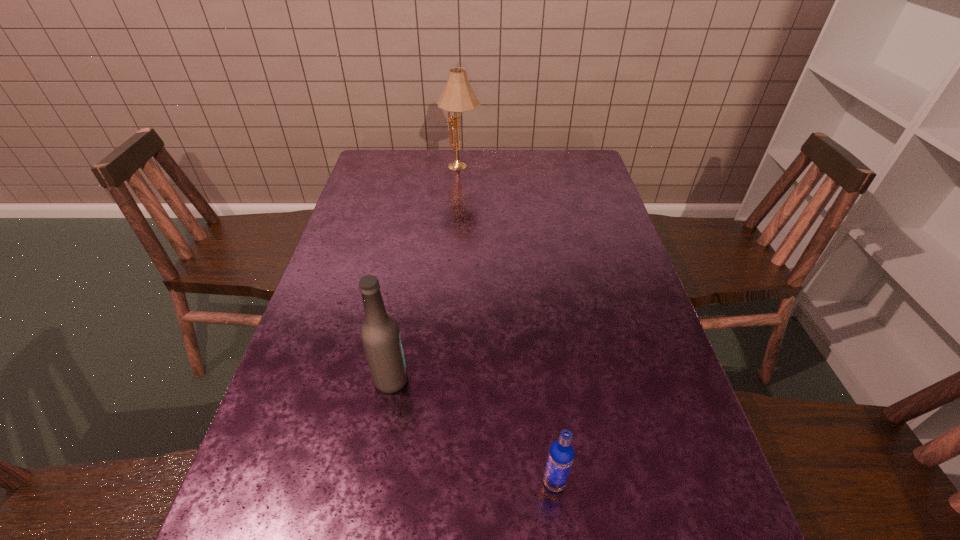
Locate an element on the screen. This screenshot has width=960, height=540. lampshade is located at coordinates (458, 96).

Identify the location of the second object from left to right. tap(458, 96).

Locate an element on the screen. the second tallest object is located at coordinates click(x=380, y=335).

Locate an element on the screen. The height and width of the screenshot is (540, 960). beer bottle is located at coordinates (380, 335).

Image resolution: width=960 pixels, height=540 pixels. Identify the location of the nearest object. (561, 454).

Find the location of `vodka`. vodka is located at coordinates (561, 454).

Locate an element on the screen. free spot located on the right of the tallest object is located at coordinates (548, 167).

Locate an element on the screen. This screenshot has height=540, width=960. vacant point located on the label of the second farthest object is located at coordinates (538, 380).

Where is `vacant position located 0.260m on the left of the rightmost object`? vacant position located 0.260m on the left of the rightmost object is located at coordinates (398, 482).

Locate an element on the screen. The image size is (960, 540). object situated at the far edge is located at coordinates (458, 96).